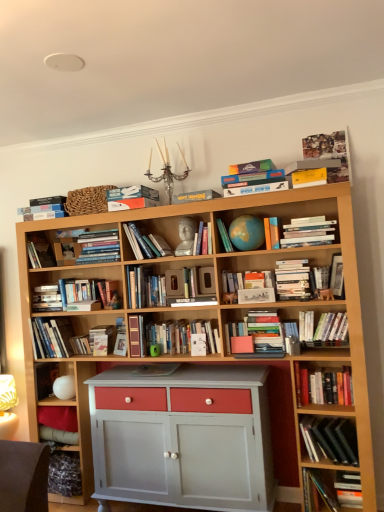
This screenshot has width=384, height=512. Identify the location of vacant area on top of hardcover book at left, which ranks as the 12th book in right-to-left order (from a real-world perspective). (59, 276).